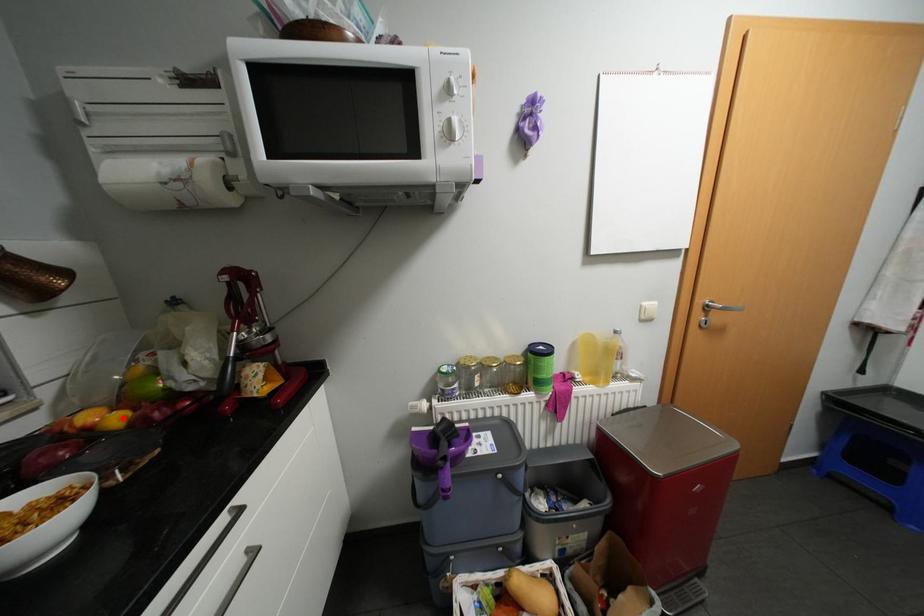
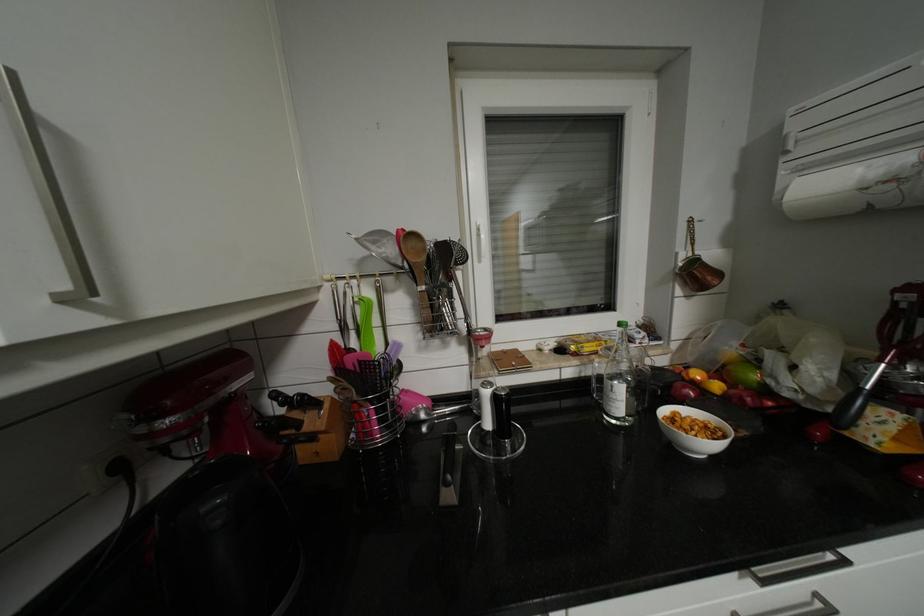
In the second image, find the point that corresponds to the highlighted location in the first image.

(724, 386)